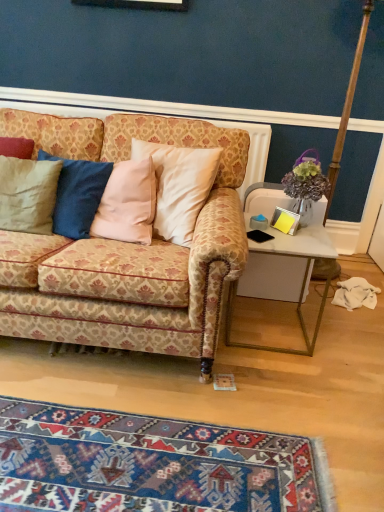
I want to click on vacant area on top of blue woven rug at lower center (from a real-world perspective), so click(x=142, y=456).